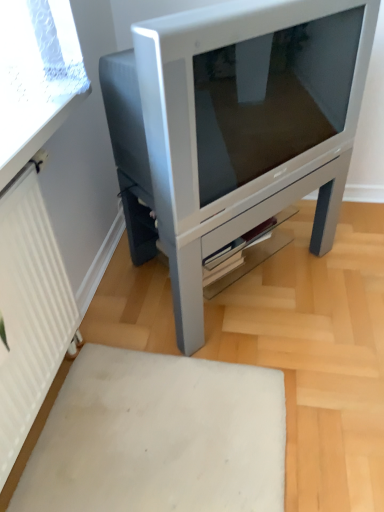
Locate an element on the screen. Image resolution: width=384 pixels, height=512 pixels. vacant space in between satin silver television at center and white ribbed radiator at left is located at coordinates (127, 371).